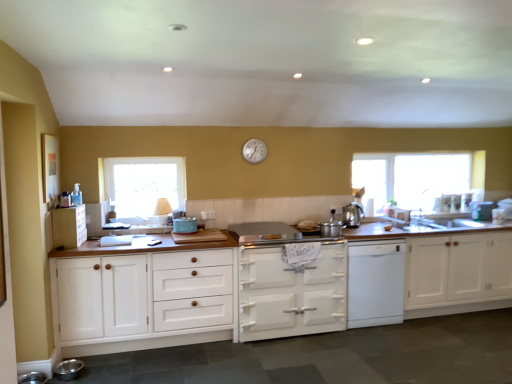
What are the coordinates of `vacant area on top of clear glass window at upper right, which is the second window in front-to-back order (from a real-world perspective)` in the screenshot? It's located at (408, 155).